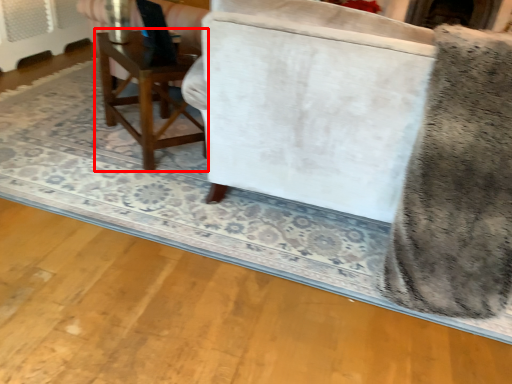
Question: From the image's perspective, what is the correct spatial relationship of table (annotated by the red box) in relation to swivel chair?

Choices:
 (A) above
 (B) below

Answer: (A)